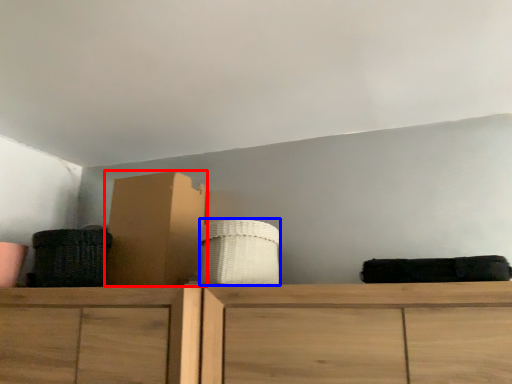
Question: Which object is further to the camera taking this photo, cardboard box (highlighted by a red box) or basket (highlighted by a blue box)?

Choices:
 (A) cardboard box
 (B) basket

Answer: (A)